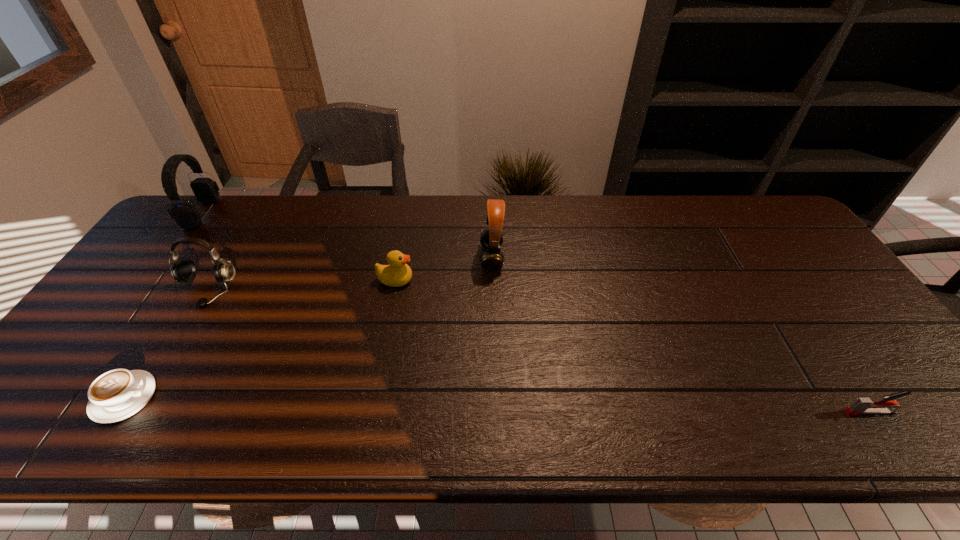
Where is `blank space located 0.240m on the headband of the leftmost headset`? The height and width of the screenshot is (540, 960). blank space located 0.240m on the headband of the leftmost headset is located at coordinates (286, 213).

Identify the location of vacant space located 0.160m on the ear cups of the rightmost headset. (426, 258).

Where is `vacant space situated 0.160m on the ear cups of the rightmost headset`? The height and width of the screenshot is (540, 960). vacant space situated 0.160m on the ear cups of the rightmost headset is located at coordinates (426, 258).

Locate an element on the screen. The height and width of the screenshot is (540, 960). free spot located 0.290m on the ear cups of the rightmost headset is located at coordinates (383, 258).

Find the location of a particular element. vacant space located with the microphone on the side of the shortest headset is located at coordinates (187, 324).

Find the location of a particular element. vacant space located at the beak of the fourth object from left to right is located at coordinates (469, 280).

Identify the location of vacant region located 0.100m on the handle side of the second shortest object. (801, 412).

Where is `vacant space located 0.400m on the handle side of the second shortest object`? vacant space located 0.400m on the handle side of the second shortest object is located at coordinates (664, 412).

Locate an element on the screen. vacant space located on the handle side of the second shortest object is located at coordinates [732, 412].

The width and height of the screenshot is (960, 540). I want to click on free space located with the handle on the right side of the cappuccino, so click(242, 397).